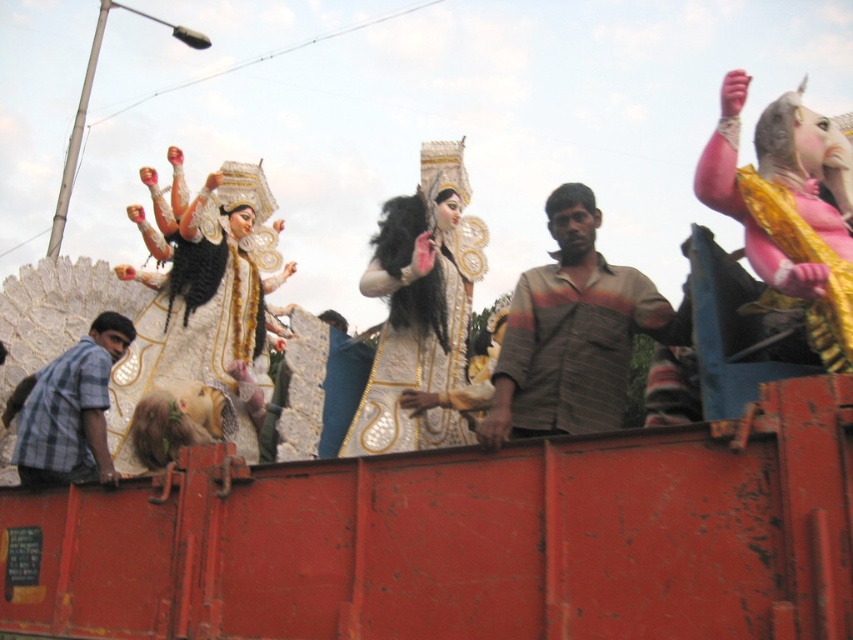
Question: Does gold metallic statue at upper center lie behind gold textured fabric at left?

Choices:
 (A) yes
 (B) no

Answer: (B)

Question: Among these objects, which one is farthest from the camera?

Choices:
 (A) gold textured fabric at left
 (B) gold metallic statue at upper center
 (C) pink fabric deity at upper right

Answer: (A)

Question: Observing the image, what is the correct spatial positioning of gold metallic statue at upper center in reference to gold textured fabric at left?

Choices:
 (A) right
 (B) left

Answer: (A)

Question: Does gold metallic statue at upper center lie in front of gold textured fabric at left?

Choices:
 (A) yes
 (B) no

Answer: (A)

Question: Which object is farther from the camera taking this photo?

Choices:
 (A) gold textured fabric at left
 (B) white glossy statue at center
 (C) gold metallic statue at upper center

Answer: (A)

Question: Which is nearer to the striped cotton shirt at center?

Choices:
 (A) pink fabric deity at upper right
 (B) checkered fabric shirt at left
 (C) gold textured fabric at left

Answer: (A)